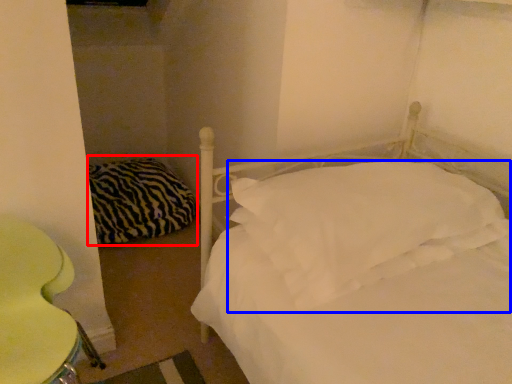
Question: Which point is further to the camera, pillow (highlighted by a red box) or pillow (highlighted by a blue box)?

Choices:
 (A) pillow
 (B) pillow

Answer: (A)